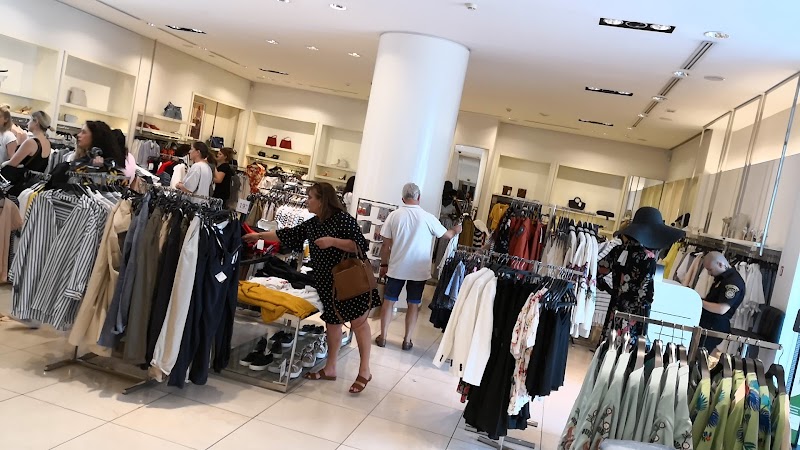
Locate an element on the screen. Image resolution: width=800 pixels, height=450 pixels. windows is located at coordinates (649, 192), (680, 194), (705, 190), (729, 189), (756, 185), (790, 353).